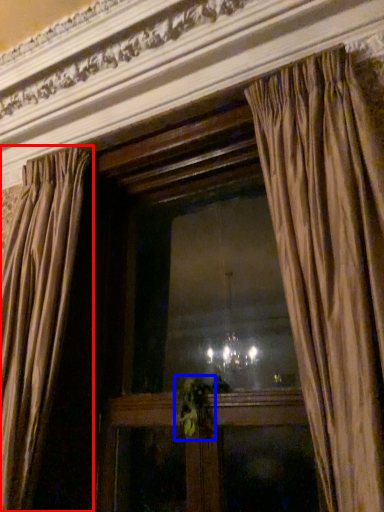
Question: Which object appears farthest to the camera in this image, curtain (highlighted by a red box) or plant (highlighted by a blue box)?

Choices:
 (A) curtain
 (B) plant

Answer: (B)